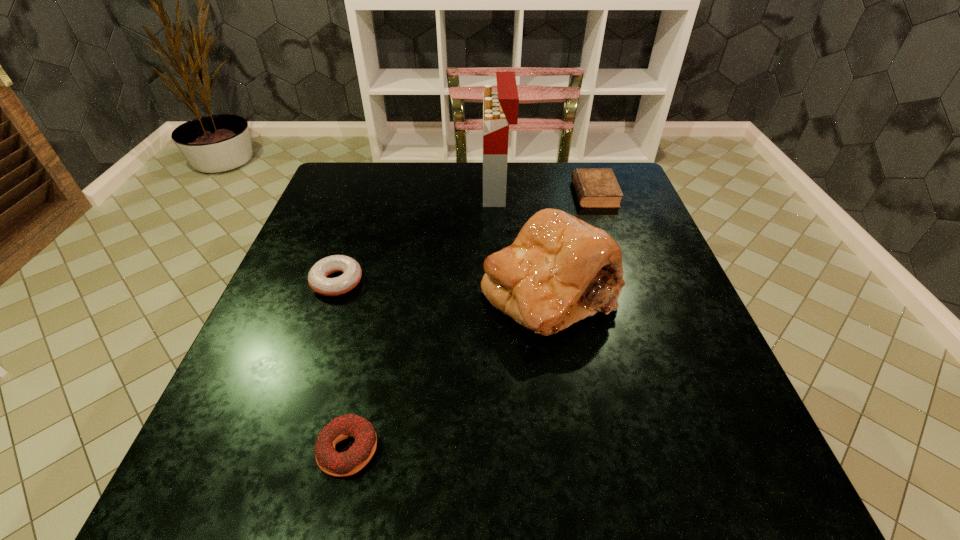
At what (x,y) coordinates should I click in order to perform the action: click on the tallest object. Please return your answer as a coordinate pair (x, y). The width and height of the screenshot is (960, 540). Looking at the image, I should click on (500, 108).

I want to click on bread, so pyautogui.click(x=559, y=270).

Locate an element on the screen. the leftmost object is located at coordinates (317, 277).

Image resolution: width=960 pixels, height=540 pixels. I want to click on the left doughnut, so click(317, 277).

Identify the location of diary. The width and height of the screenshot is (960, 540). (595, 187).

The height and width of the screenshot is (540, 960). I want to click on the nearer doughnut, so click(x=349, y=462).

I want to click on the right doughnut, so click(x=349, y=462).

Find the location of a particular element. This screenshot has width=960, height=540. vacant region located with the lid open on the tallest object is located at coordinates (381, 189).

The height and width of the screenshot is (540, 960). Find the location of `vacant space situated with the lid open on the tallest object`. vacant space situated with the lid open on the tallest object is located at coordinates (359, 189).

The width and height of the screenshot is (960, 540). Identify the location of vacant space located 0.130m with the lid open on the tallest object. (436, 189).